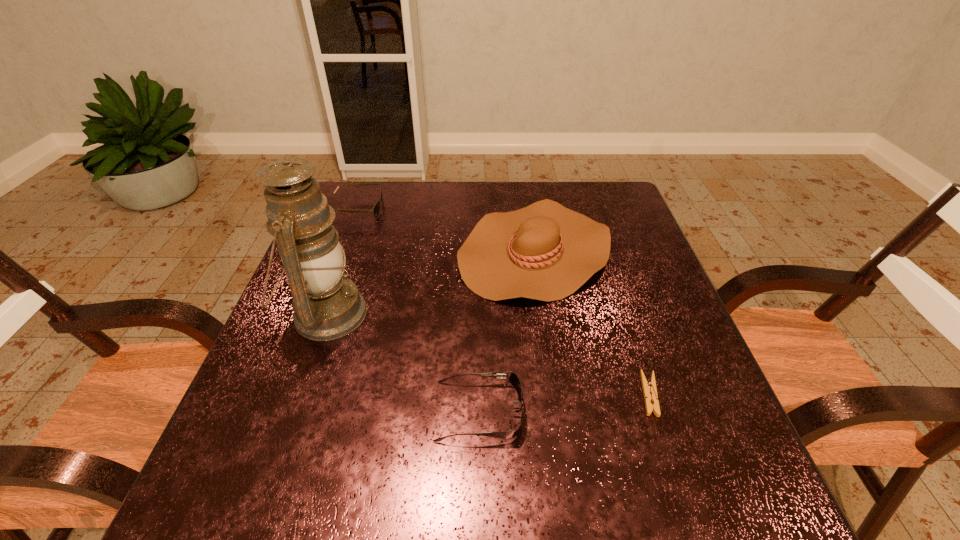
Locate an element on the screen. vacant position located on the left of the clothespin is located at coordinates (x=489, y=394).

Locate an element on the screen. The height and width of the screenshot is (540, 960). cowboy hat situated at the far edge is located at coordinates (545, 251).

At what (x,y) coordinates should I click in order to perform the action: click on sunglasses present at the far edge. Please return your answer as a coordinate pair (x, y). Looking at the image, I should click on (375, 210).

Locate an element on the screen. This screenshot has width=960, height=540. oil lamp that is at the left edge is located at coordinates (327, 306).

The image size is (960, 540). Identify the location of sunglasses located in the left edge section of the desktop. (375, 210).

I want to click on cowboy hat that is at the right edge, so click(545, 251).

This screenshot has height=540, width=960. Identify the location of clothespin at the right edge. (649, 388).

The image size is (960, 540). Identify the location of object located at the far left corner. (375, 210).

Where is `object that is at the far right corner`? This screenshot has height=540, width=960. object that is at the far right corner is located at coordinates (545, 251).

At what (x,y) coordinates should I click in order to perform the action: click on free location at the far edge. Please return your answer as a coordinate pair (x, y). The image size is (960, 540). Looking at the image, I should click on (392, 207).